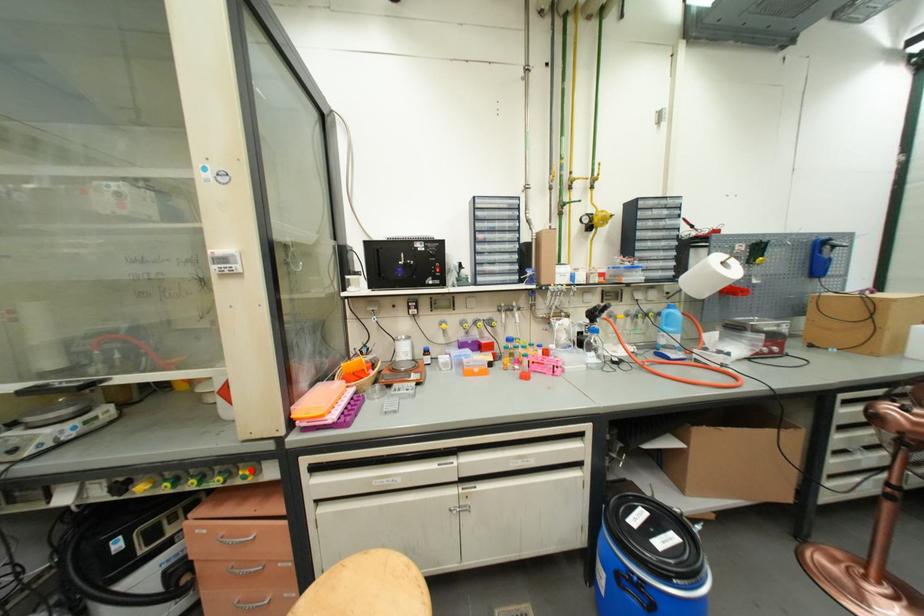
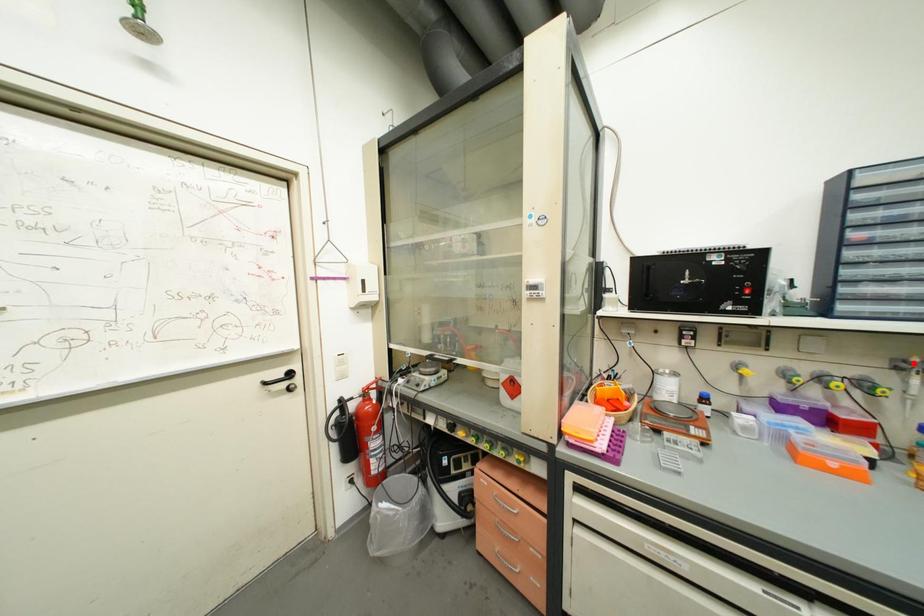
Consider the image. I am providing you with two images of the same scene from different viewpoints. A red point is marked on the first image and another point is marked on the second image. Is the red point in image1 aligned with the point shown in image2?

No